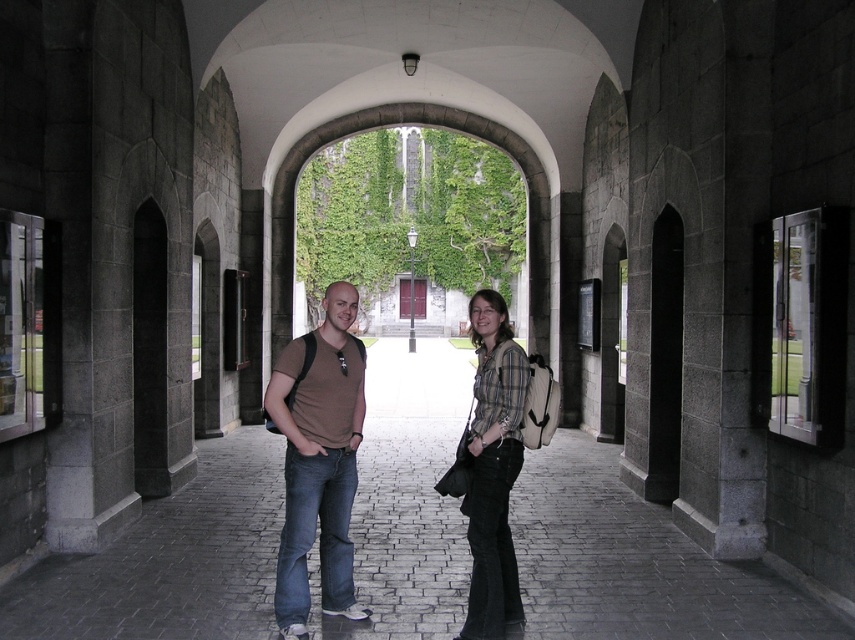
Who is positioned more to the right, matte brown t-shirt at center or plaid shirt at center?

From the viewer's perspective, plaid shirt at center appears more on the right side.

Does matte brown t-shirt at center have a larger size compared to plaid shirt at center?

No, matte brown t-shirt at center is not bigger than plaid shirt at center.

Who is more forward, (315, 346) or (475, 417)?

Positioned in front is point (315, 346).

Where is `matte brown t-shirt at center`? matte brown t-shirt at center is located at coordinates (317, 460).

Based on the photo, does brown cotton shirt at center appear on the right side of matte brown t-shirt at center?

Correct, you'll find brown cotton shirt at center to the right of matte brown t-shirt at center.

Can you confirm if brown cotton shirt at center is positioned to the left of matte brown t-shirt at center?

No, brown cotton shirt at center is not to the left of matte brown t-shirt at center.

In the scene shown: Who is more distant from viewer, (488,438) or (307,419)?

The point (307,419) is behind.

What are the coordinates of `brown cotton shirt at center` in the screenshot? It's located at (317, 461).

Does brown cotton shirt at center have a greater height compared to plaid shirt at center?

Yes.

Measure the distance between point (x=329, y=488) and camera.

A distance of 4.30 meters exists between point (x=329, y=488) and camera.

Image resolution: width=855 pixels, height=640 pixels. Identify the location of brown cotton shirt at center. (317, 461).

The width and height of the screenshot is (855, 640). Identify the location of brown cotton shirt at center. pyautogui.click(x=317, y=461).